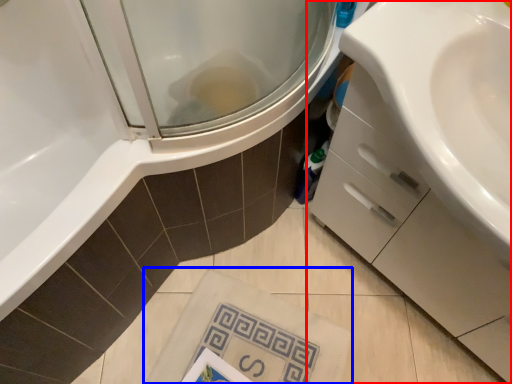
Question: Which of the following is the farthest to the observer, bathroom cabinet (highlighted by a red box) or beach towel (highlighted by a blue box)?

Choices:
 (A) bathroom cabinet
 (B) beach towel

Answer: (B)